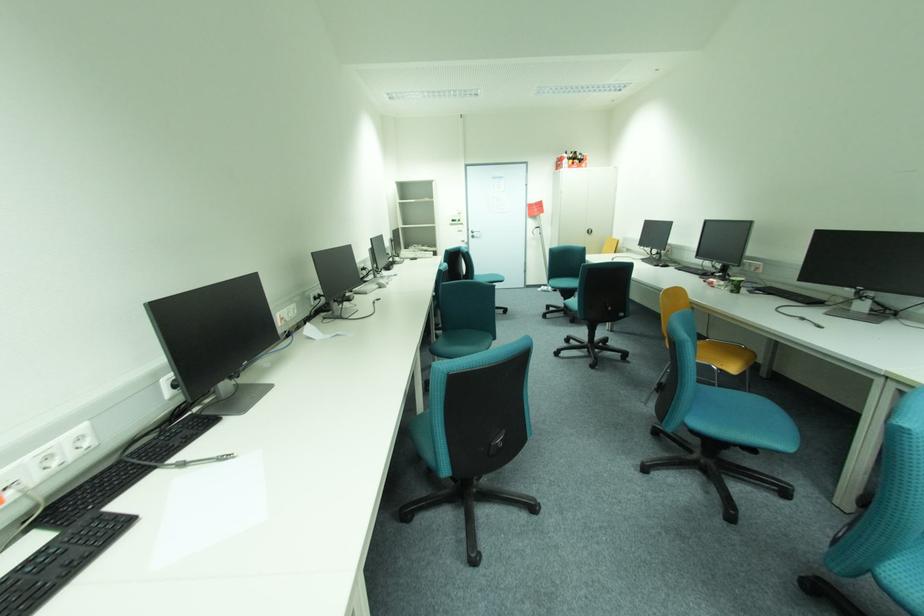
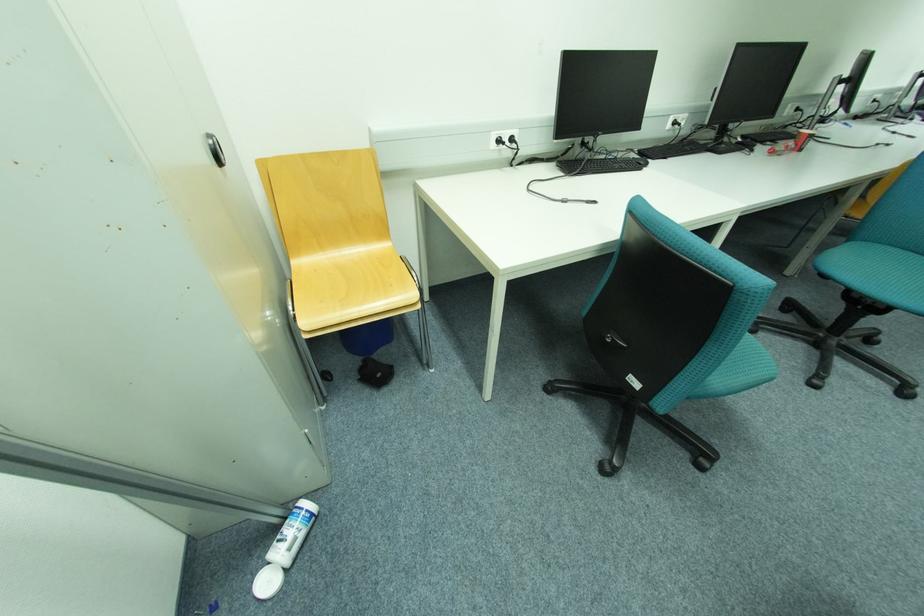
Locate, in the second image, the point that corresponds to (x=545, y=290) in the first image.

(274, 584)